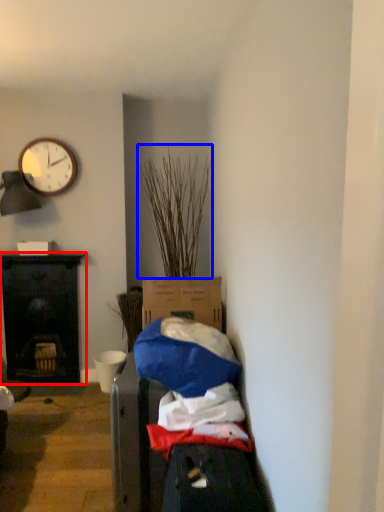
Question: Among these objects, which one is nearest to the camera, desk (highlighted by a red box) or plant (highlighted by a blue box)?

Choices:
 (A) desk
 (B) plant

Answer: (B)